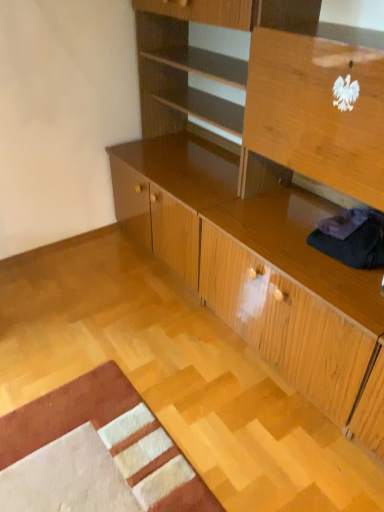
Looking at this image, what is the approximate width of wooden cabinet at right?

The width of wooden cabinet at right is 24.51 inches.

In order to face wooden cabinet at right, should I rotate leftwards or rightwards?

It's best to rotate right around 17.642 degrees.

What do you see at coordinates (293, 305) in the screenshot? I see `wooden cabinet at right` at bounding box center [293, 305].

Find the location of a particular element. wooden cabinet at right is located at coordinates (293, 305).

Where is `wooden cabinet at right`? Image resolution: width=384 pixels, height=512 pixels. wooden cabinet at right is located at coordinates (293, 305).